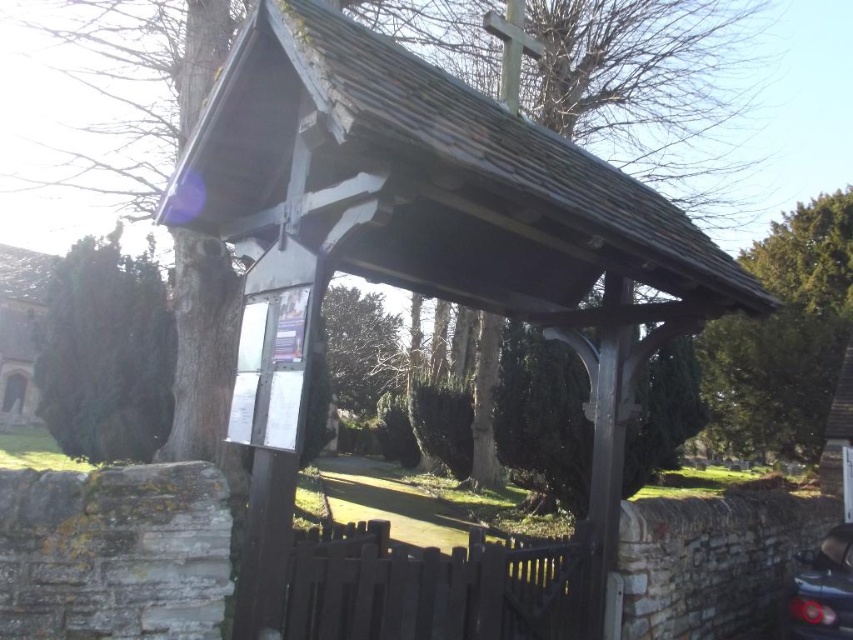
You are a pedestrian approaching the wooden lychgate. You see a green leafy tree at upper right and a shiny black car at lower right. Which object is located to the right of the other?

The green leafy tree at upper right is positioned on the right side of shiny black car at lower right.

In the scene shown: You are standing at the center of the lychgate. Looking towards the upper right corner of the image, can you see the green leafy tree at upper right? Please explain its position relative to the lychgate.

Yes, the green leafy tree at upper right is located at point [784,337], which is in the upper right corner of the image. From the center of the lychgate, it appears in the upper right direction, positioned above and to the right of the gate.